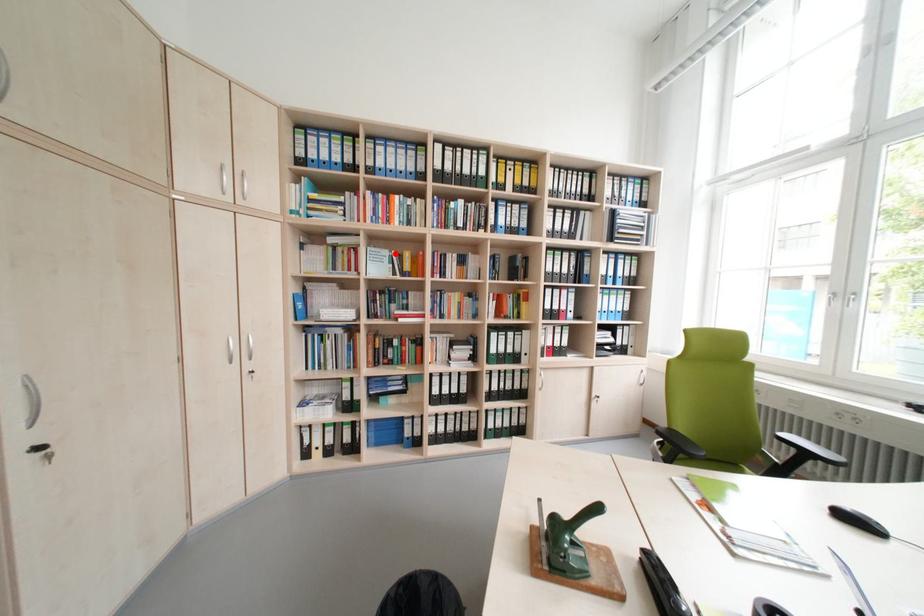
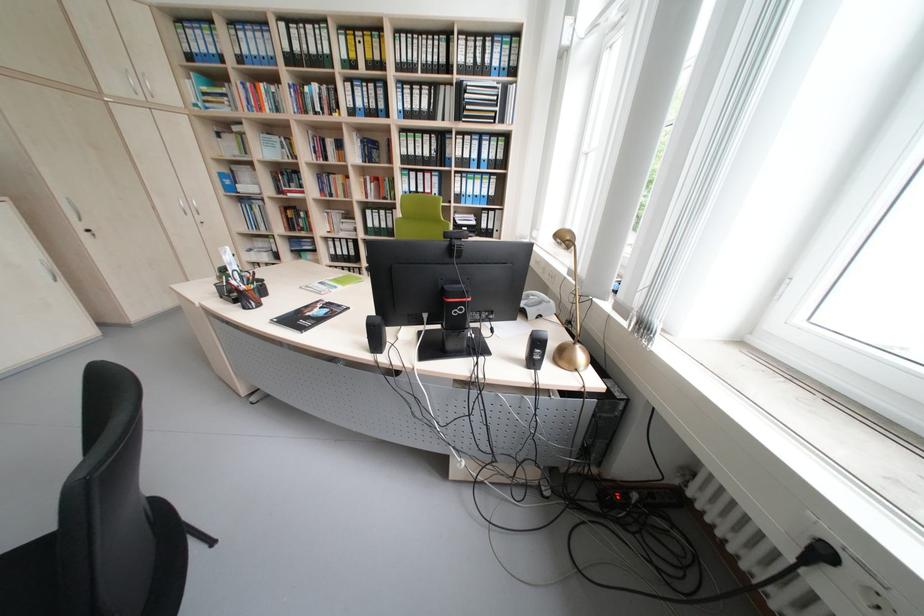
Find the pixel in the second image that matches the highlighted location in the first image.

(286, 140)